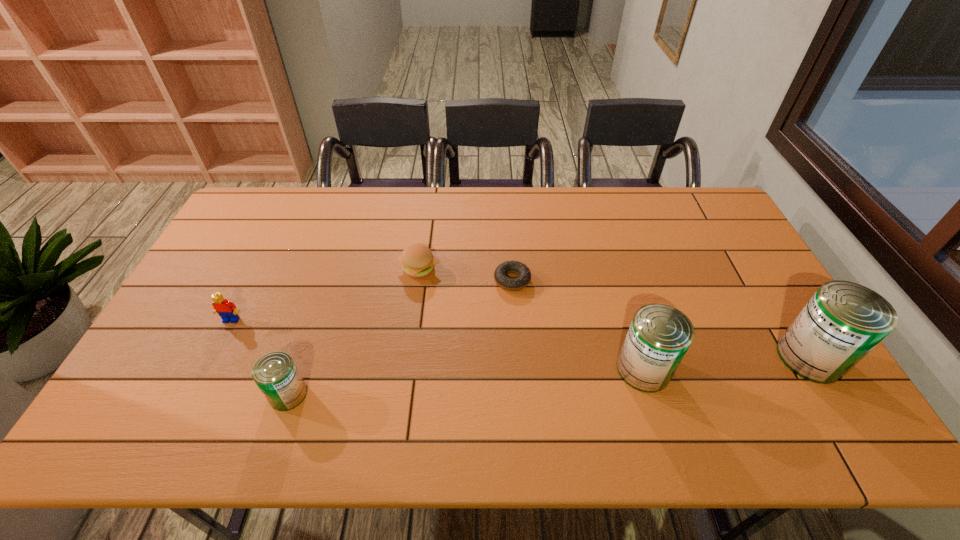
The height and width of the screenshot is (540, 960). I want to click on empty location between the doughnut and the fourth nearest object, so click(x=372, y=300).

Locate an element on the screen. This screenshot has height=540, width=960. free space between the leftmost can and the rightmost can is located at coordinates (549, 376).

Where is `empty location between the shortest can and the shortest object`? The height and width of the screenshot is (540, 960). empty location between the shortest can and the shortest object is located at coordinates (400, 337).

Locate an element on the screen. This screenshot has height=540, width=960. vacant space that is in between the fifth tallest object and the leftmost can is located at coordinates (353, 331).

At what (x,y) coordinates should I click in order to perform the action: click on object that is the second closest to the hamburger. Please return your answer as a coordinate pair (x, y). The image size is (960, 540). Looking at the image, I should click on (275, 373).

Locate an element on the screen. object that is the nearest to the rightmost can is located at coordinates (659, 336).

Locate which can ranks in proximity to the leftmost object. Please provide its 2D coordinates. Your answer should be formatted as a tuple, i.e. [(x, y)], where the tuple contains the x and y coordinates of a point satisfying the conditions above.

[(275, 373)]

Select which can appears as the closest to the hamburger. Please provide its 2D coordinates. Your answer should be formatted as a tuple, i.e. [(x, y)], where the tuple contains the x and y coordinates of a point satisfying the conditions above.

[(275, 373)]

Where is `free space that satisfies the following two spatial constraints: 1. on the back side of the doughnut; 2. on the right side of the leftmost can`? This screenshot has width=960, height=540. free space that satisfies the following two spatial constraints: 1. on the back side of the doughnut; 2. on the right side of the leftmost can is located at coordinates (326, 280).

You are a GUI agent. You are given a task and a screenshot of the screen. Output one action in this format:
    pyautogui.click(x=<x>, y=<y>)
    Task: Click on the free space that satisfies the following two spatial constraints: 1. on the front-facing side of the second object from right to left; 2. on the right side of the third farthest object
    This screenshot has width=960, height=540.
    Given the screenshot: What is the action you would take?
    pyautogui.click(x=207, y=369)